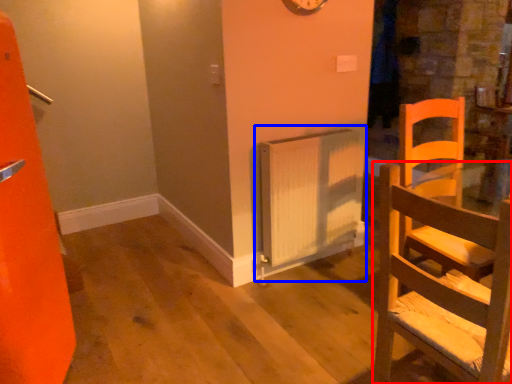
Question: Which of the following is the closest to the observer, chair (highlighted by a red box) or radiator (highlighted by a blue box)?

Choices:
 (A) chair
 (B) radiator

Answer: (A)